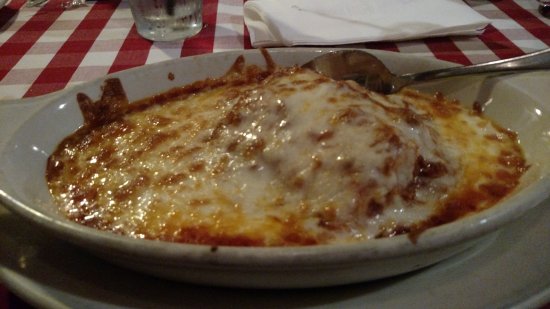
This screenshot has width=550, height=309. Identify the location of spoon. (351, 66).